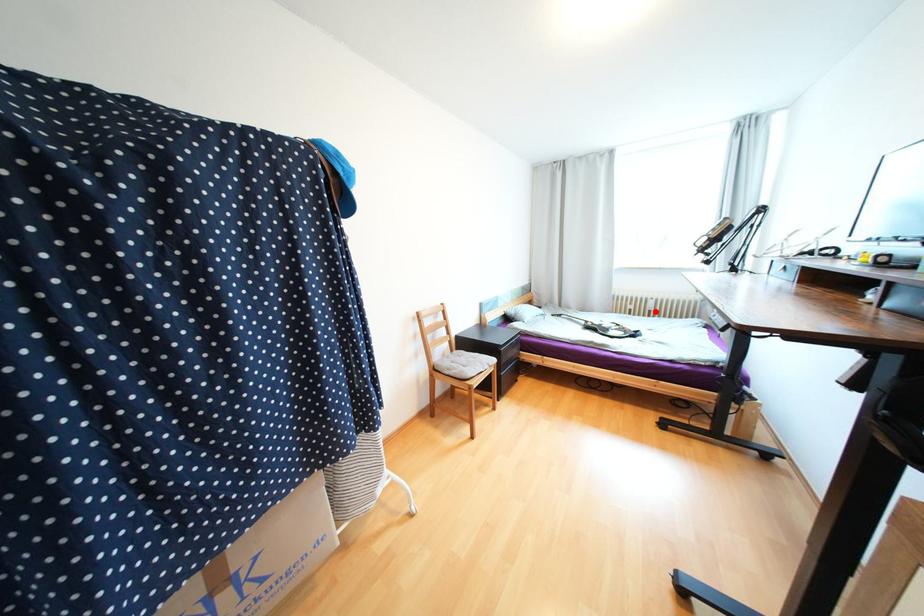
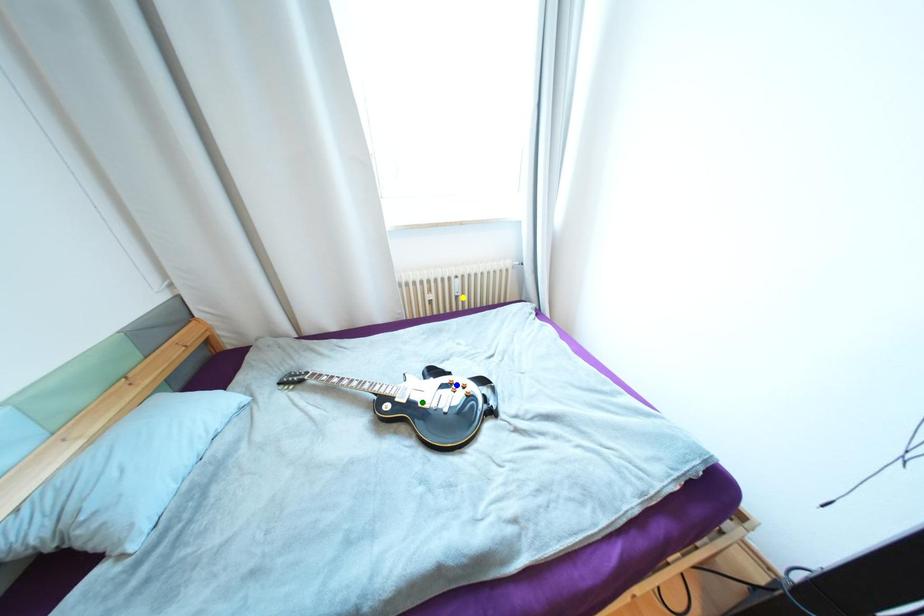
Question: I am providing you with two images of the same scene from different viewpoints. A red point is marked on the first image. You are given multiple points on the second image. Which mark in image 2 goes with the point in image 1?

Choices:
 (A) green point
 (B) yellow point
 (C) blue point

Answer: (B)